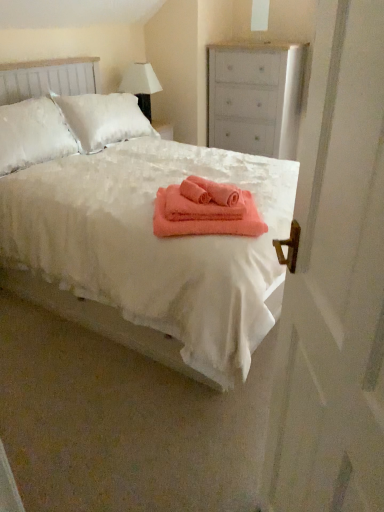
Question: Is white fabric lampshade at upper center taller than white fluffy bed at center?

Choices:
 (A) no
 (B) yes

Answer: (A)

Question: From the image's perspective, is white fabric lampshade at upper center on white fluffy bed at center?

Choices:
 (A) yes
 (B) no

Answer: (A)

Question: Can white fluffy bed at center be found inside white fabric lampshade at upper center?

Choices:
 (A) no
 (B) yes

Answer: (A)

Question: Is the position of white fabric lampshade at upper center less distant than that of white fluffy bed at center?

Choices:
 (A) yes
 (B) no

Answer: (B)

Question: Is white fabric lampshade at upper center positioned beyond the bounds of white fluffy bed at center?

Choices:
 (A) yes
 (B) no

Answer: (A)

Question: Is point (279, 394) positioned closer to the camera than point (188, 216)?

Choices:
 (A) farther
 (B) closer

Answer: (B)

Question: In terms of height, does white matte screen door at right look taller or shorter compared to coral soft towel at center, the second bath towel when ordered from top to bottom?

Choices:
 (A) short
 (B) tall

Answer: (B)

Question: Considering their positions, is white matte screen door at right located in front of or behind coral soft towel at center, the 1th bath towel in the bottom-to-top sequence?

Choices:
 (A) behind
 (B) front

Answer: (B)

Question: In terms of width, does white matte screen door at right look wider or thinner when compared to coral soft towel at center, the second bath towel when ordered from top to bottom?

Choices:
 (A) thin
 (B) wide

Answer: (A)

Question: Considering the positions of point (71, 225) and point (288, 105), is point (71, 225) closer or farther from the camera than point (288, 105)?

Choices:
 (A) closer
 (B) farther

Answer: (A)

Question: In terms of size, does white fluffy bed at center appear bigger or smaller than white matte chest of drawers at upper right?

Choices:
 (A) small
 (B) big

Answer: (B)

Question: Considering the positions of white fluffy bed at center and white matte chest of drawers at upper right in the image, is white fluffy bed at center wider or thinner than white matte chest of drawers at upper right?

Choices:
 (A) wide
 (B) thin

Answer: (A)

Question: From a real-world perspective, is white fluffy bed at center positioned above or below white matte chest of drawers at upper right?

Choices:
 (A) below
 (B) above

Answer: (A)

Question: Is coral soft towel at center, the second bath towel when ordered from top to bottom, wider or thinner than white matte screen door at right?

Choices:
 (A) wide
 (B) thin

Answer: (A)

Question: From a real-world perspective, is coral soft towel at center, the second bath towel when ordered from top to bottom, physically located above or below white matte screen door at right?

Choices:
 (A) below
 (B) above

Answer: (A)